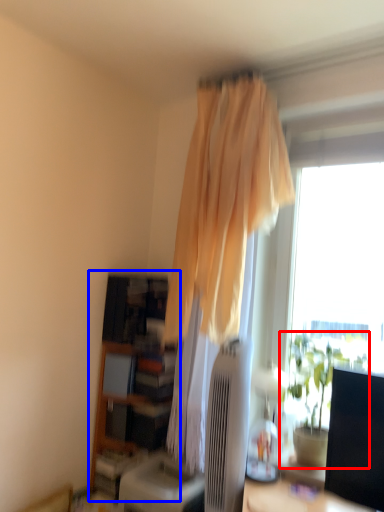
Question: Which object is closer to the camera taking this photo, houseplant (highlighted by a red box) or bookshelf (highlighted by a blue box)?

Choices:
 (A) houseplant
 (B) bookshelf

Answer: (A)